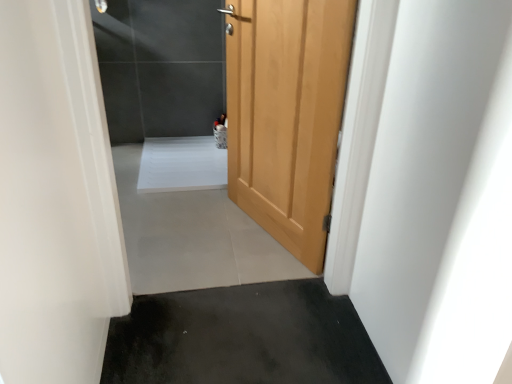
Question: From their relative heights in the image, would you say wooden door at center is taller or shorter than black rubber mat at lower center, acting as the second concrete starting from the top?

Choices:
 (A) short
 (B) tall

Answer: (B)

Question: Is point (226, 87) positioned closer to the camera than point (266, 355)?

Choices:
 (A) closer
 (B) farther

Answer: (B)

Question: Considering the real-world distances, which object is farthest from the wooden door at center?

Choices:
 (A) gray tile floor at center, arranged as the second concrete when viewed from the front
 (B) black rubber mat at lower center, the 1th concrete positioned from the bottom
 (C) wooden door at center

Answer: (C)

Question: Which object is positioned farthest from the black rubber mat at lower center, the first concrete positioned from the front?

Choices:
 (A) gray tile floor at center, the 1th concrete when ordered from back to front
 (B) wooden door at center
 (C) wooden door at center

Answer: (C)